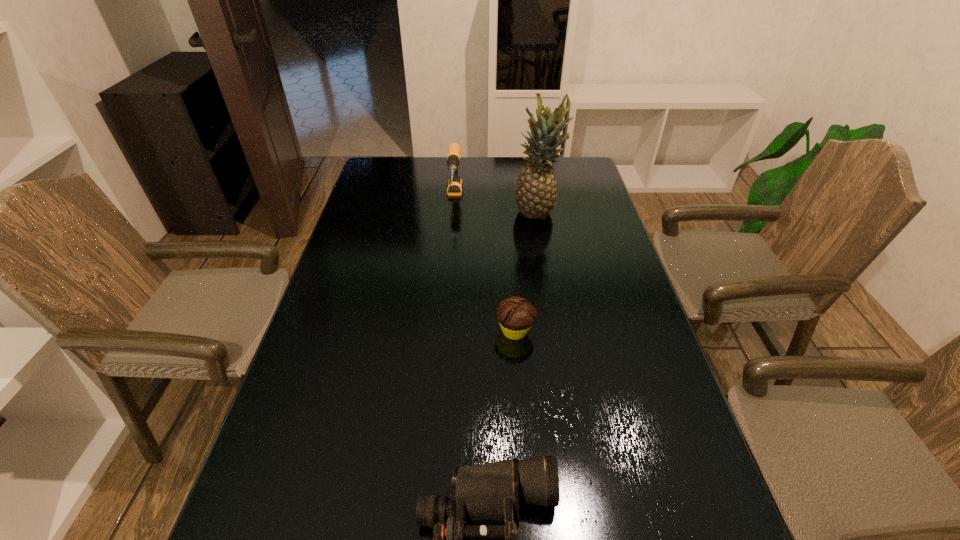
You are a GUI agent. You are given a task and a screenshot of the screen. Output one action in this format:
    pyautogui.click(x=<x>, y=<y>)
    Task: Click on the pineapple
    Image resolution: width=960 pixels, height=540 pixels.
    Given the screenshot: What is the action you would take?
    pyautogui.click(x=536, y=192)

This screenshot has height=540, width=960. What are the coordinates of `the second tallest object` in the screenshot? It's located at (455, 185).

Identify the location of the third farthest object. (516, 315).

Where is `free space located on the front of the pineapple`? Image resolution: width=960 pixels, height=540 pixels. free space located on the front of the pineapple is located at coordinates (547, 269).

Locate an element on the screen. The image size is (960, 540). free spot located 0.400m on the handle side of the third shortest object is located at coordinates (446, 306).

Find the location of `free space located 0.110m on the right of the third farthest object`. free space located 0.110m on the right of the third farthest object is located at coordinates (579, 331).

The width and height of the screenshot is (960, 540). Find the location of `object that is at the far edge`. object that is at the far edge is located at coordinates (455, 185).

At what (x,y) coordinates should I click in order to perform the action: click on object present at the right edge. Please return your answer as a coordinate pair (x, y). This screenshot has width=960, height=540. Looking at the image, I should click on (536, 192).

Locate an element on the screen. This screenshot has height=540, width=960. blank area at the far edge is located at coordinates (486, 164).

Find the location of `vacant area at the left edge`. vacant area at the left edge is located at coordinates (361, 299).